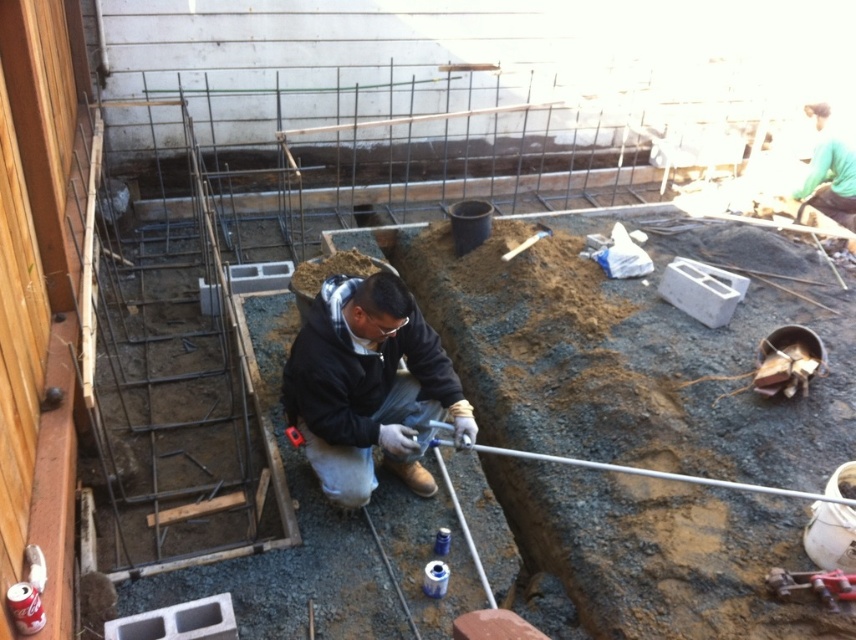
You are a construction worker standing at the point with coordinates point (794, 582). You need to move to the point with coordinates point (428, 416). Which direction should you move to reach your destination?

Point (428, 416) is behind point (794, 582), so you should move backward to reach the destination.

You are a safety inspector at the construction site. You notice two workers wearing different clothing items. One is wearing a black matte jacket at center, and the other has a green fabric shirt at upper right. Based on the clothing widths, which worker might be more visible from a distance? Explain your reasoning.

The black matte jacket at center has a greater width than the green fabric shirt at upper right. Since wider clothing items can make a person more visible from a distance, the worker wearing the black matte jacket at center is likely more visible.

You are a construction worker who needs to retrieve the metallic red drill at lower right to finish a task. However, you are currently standing near the green fabric shirt at upper right. Can you reach the drill without moving the shirt?

The metallic red drill at lower right is behind the green fabric shirt at upper right, so you can reach the drill without needing to move the shirt as it is positioned behind it.